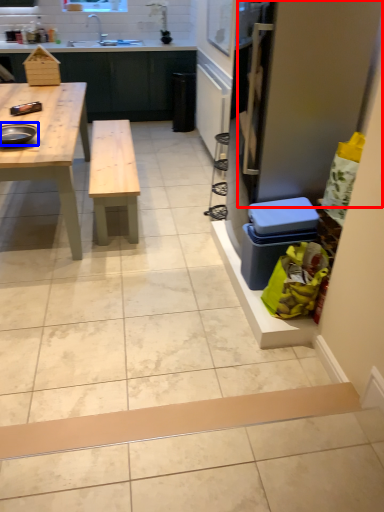
Question: Among these objects, which one is farthest to the camera, screen door (highlighted by a red box) or appliance (highlighted by a blue box)?

Choices:
 (A) screen door
 (B) appliance

Answer: (B)